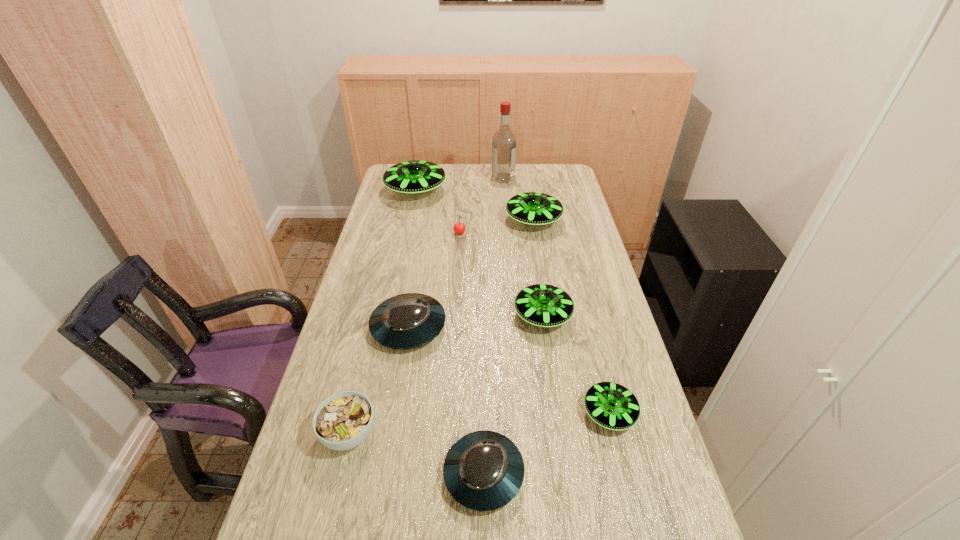
The image size is (960, 540). I want to click on liquor, so click(x=504, y=144).

Locate an element on the screen. Image resolution: width=960 pixels, height=540 pixels. the eighth shortest object is located at coordinates (414, 176).

Locate an element on the screen. The image size is (960, 540). the tallest saucer is located at coordinates click(x=414, y=176).

You are a GUI agent. You are given a task and a screenshot of the screen. Output one action in this format:
    pyautogui.click(x=<x>, y=<y>)
    Task: Click on the fifth shortest saucer
    Image resolution: width=960 pixels, height=540 pixels.
    Given the screenshot: What is the action you would take?
    pyautogui.click(x=531, y=208)

Where is `red cherry`? red cherry is located at coordinates (459, 228).

Identify the location of the second smallest green saucer. (543, 305).

The image size is (960, 540). I want to click on the left gray saucer, so click(406, 321).

You are a GUI agent. You are given a task and a screenshot of the screen. Output one action in this format:
    pyautogui.click(x=<x>, y=<y>)
    Task: Click on the farther gray saucer
    The image size is (960, 540).
    Given the screenshot: What is the action you would take?
    pyautogui.click(x=406, y=321)

Locate an element on the screen. Image resolution: width=960 pixels, height=540 pixels. white soup bowl is located at coordinates (344, 420).

Locate an element on the screen. the smallest green saucer is located at coordinates 611,405.